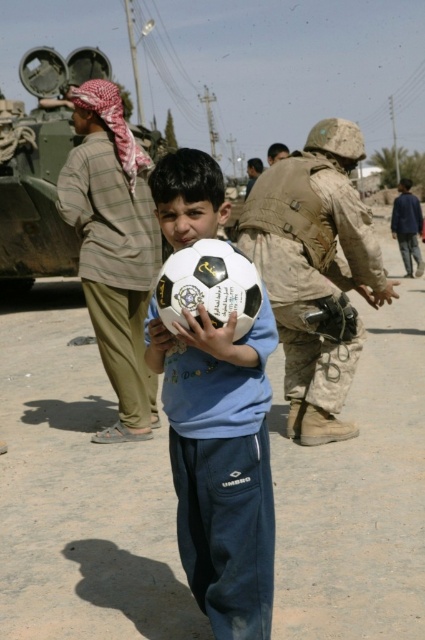
What do you see at coordinates (221, 465) in the screenshot? The width and height of the screenshot is (425, 640). I see `white matte soccer ball at center` at bounding box center [221, 465].

Describe the element at coordinates (221, 465) in the screenshot. The height and width of the screenshot is (640, 425). I see `white matte soccer ball at center` at that location.

In order to click on white matte soccer ball at center in this screenshot , I will do `click(221, 465)`.

Looking at this image, who is shorter, white matte soccer ball at center or khaki cotton pants at left?

Standing shorter between the two is white matte soccer ball at center.

Identify the location of white matte soccer ball at center. This screenshot has width=425, height=640. (221, 465).

How far apart are khaki cotton pants at left and camouflage painted tank at upper left?

khaki cotton pants at left is 5.53 meters from camouflage painted tank at upper left.

Measure the distance between point (61, 216) and camera.

Point (61, 216) and camera are 17.81 feet apart from each other.

This screenshot has width=425, height=640. In order to click on khaki cotton pants at left in this screenshot , I will do 115,266.